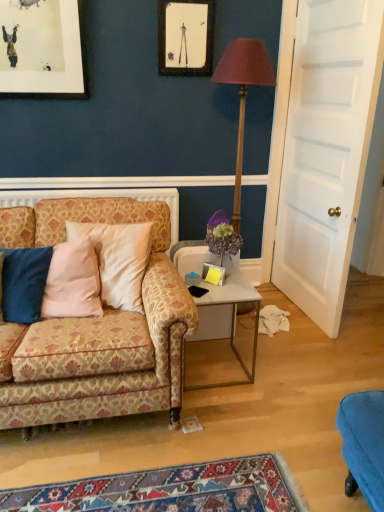
This screenshot has width=384, height=512. What are the coordinates of `vacant space underneath matte purple vase at center (from a real-world perspective)` in the screenshot? It's located at (231, 279).